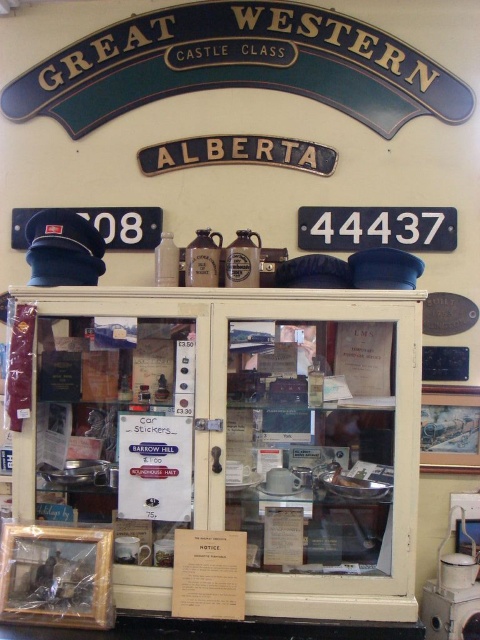
Question: Among these objects, which one is farthest from the camera?

Choices:
 (A) white paper notice at center
 (B) white paper at center

Answer: (B)

Question: In this image, where is white paper at center located relative to white paper notice at center?

Choices:
 (A) left
 (B) right

Answer: (A)

Question: Can you confirm if white paper at center is wider than white paper notice at center?

Choices:
 (A) no
 (B) yes

Answer: (B)

Question: Is white paper at center above white paper notice at center?

Choices:
 (A) yes
 (B) no

Answer: (A)